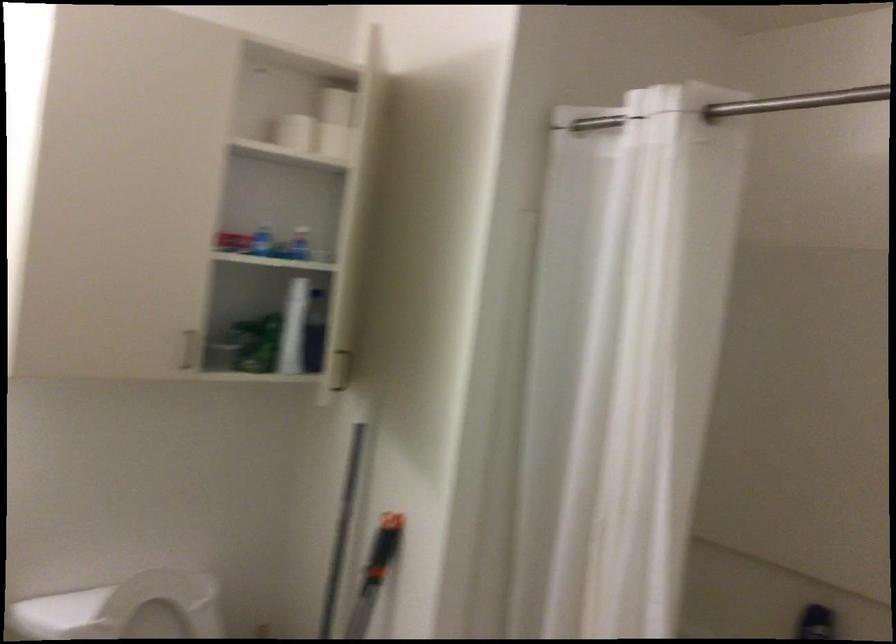
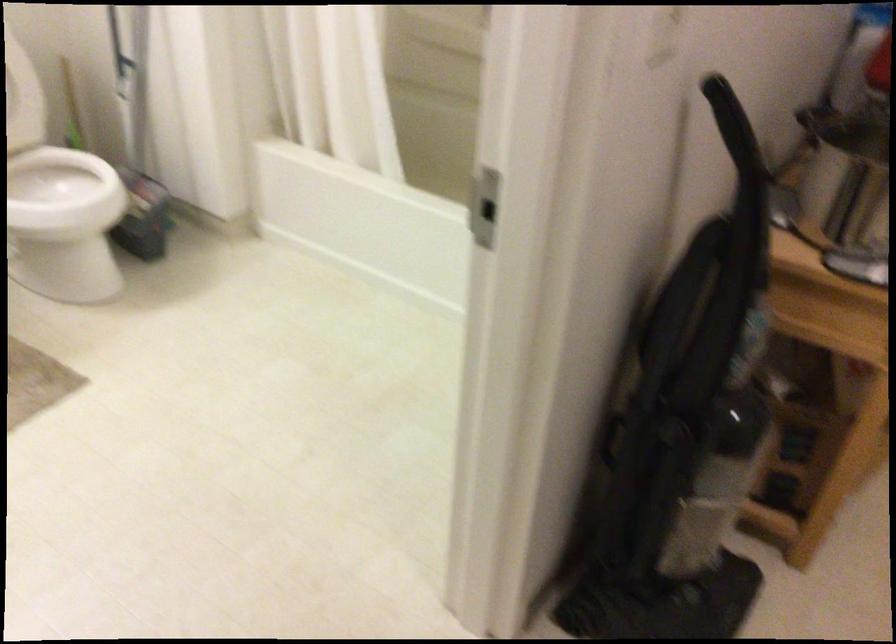
Question: The images are taken continuously from a first-person perspective. In which direction is your viewpoint rotating?

Choices:
 (A) Left
 (B) Right
 (C) Up
 (D) Down

Answer: (D)